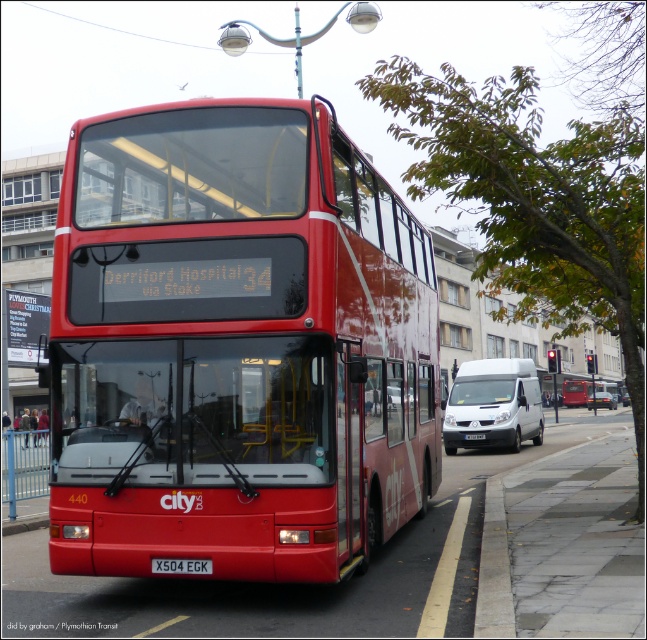
Question: Among these objects, which one is farthest from the camera?

Choices:
 (A) white matte van at center-right
 (B) matte white van at center

Answer: (B)

Question: Can you confirm if matte red bus at center is positioned to the right of white plastic license plate at center?

Choices:
 (A) no
 (B) yes

Answer: (B)

Question: Is shiny red bus at center below white plastic license plate at center?

Choices:
 (A) no
 (B) yes

Answer: (A)

Question: Which point appears closest to the camera in this image?

Choices:
 (A) (503, 380)
 (B) (179, 572)
 (C) (587, 403)
 (D) (78, 483)

Answer: (B)

Question: In this image, where is black plastic license plate at center located relative to matte white van at center?

Choices:
 (A) below
 (B) above

Answer: (B)

Question: Which point is farther to the camera?

Choices:
 (A) matte red bus at center
 (B) matte white van at center

Answer: (A)